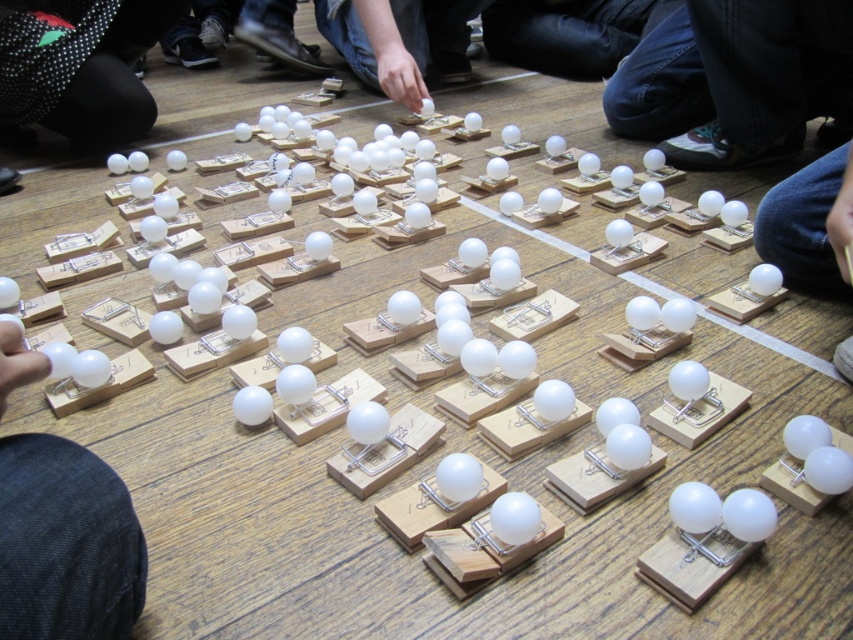
Question: Is white matte ping pong ball at lower left positioned in front of white matte ping pong ball at lower right?

Choices:
 (A) yes
 (B) no

Answer: (A)

Question: Does white matte ping pong ball at lower left come in front of white matte ping pong ball at lower right?

Choices:
 (A) no
 (B) yes

Answer: (B)

Question: Is white matte ping pong ball at lower left bigger than white matte ping pong ball at lower right?

Choices:
 (A) no
 (B) yes

Answer: (A)

Question: Which point appears closest to the camera in this image?

Choices:
 (A) (123, 566)
 (B) (846, 193)

Answer: (A)